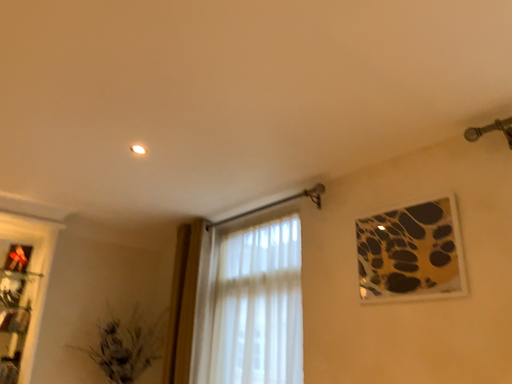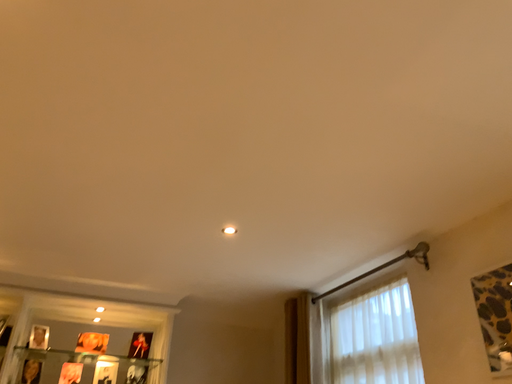
Question: Which way did the camera rotate in the video?

Choices:
 (A) rotated right
 (B) rotated left

Answer: (B)